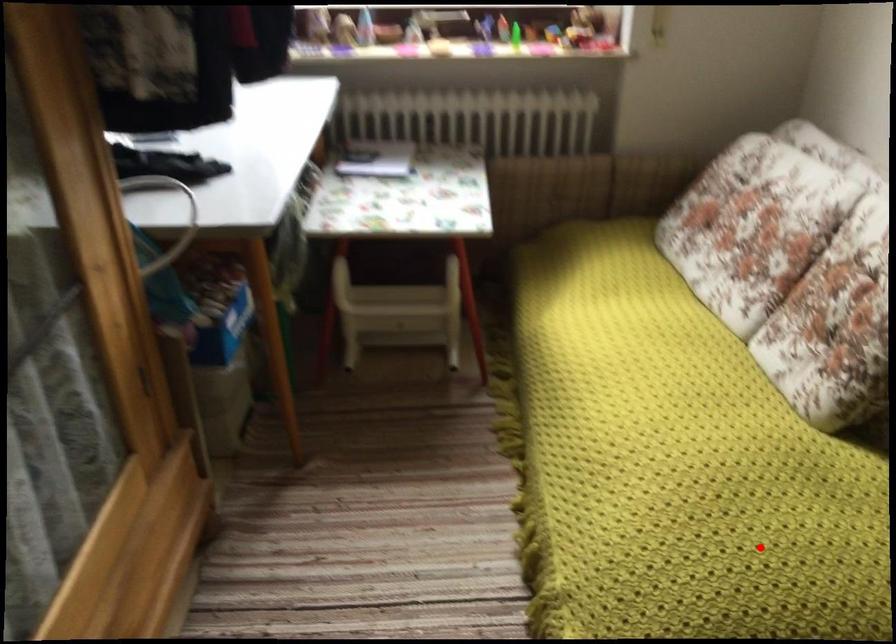
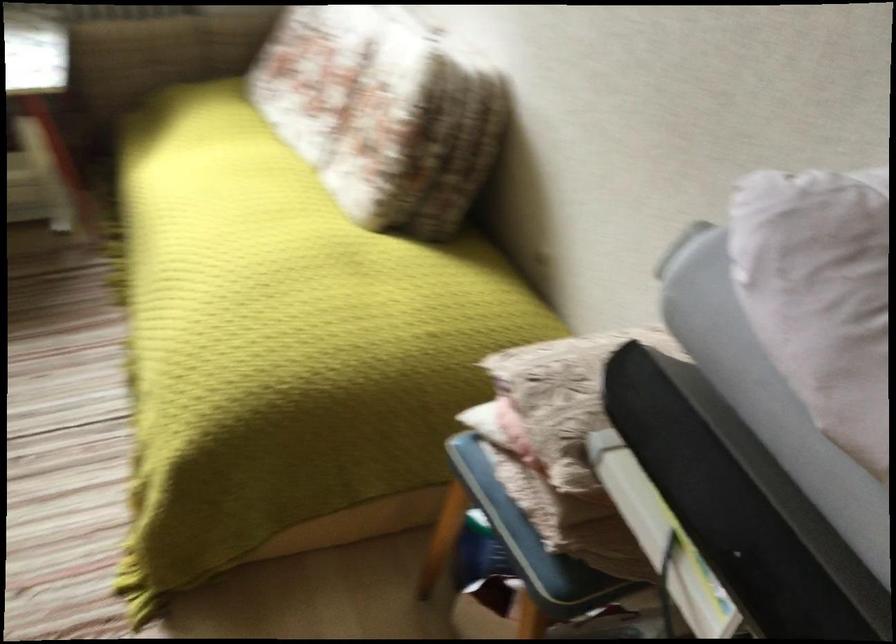
Question: A red point is marked in image1. In image2, is the corresponding 3D point closer to the camera or farther? Reply with the corresponding letter.

Choices:
 (A) The corresponding 3D point is closer.
 (B) The corresponding 3D point is farther.

Answer: (B)